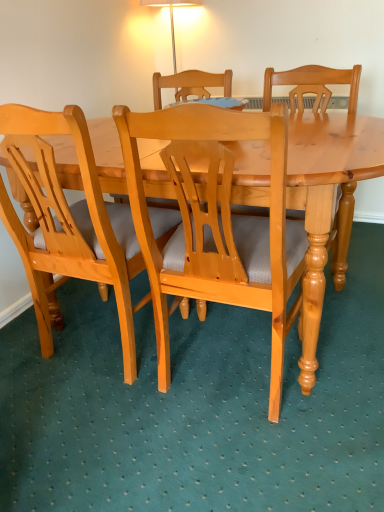
Find the location of `vacant area in front of light brown wood chair at center, positioned as the first chair in right-to-left order`. vacant area in front of light brown wood chair at center, positioned as the first chair in right-to-left order is located at coordinates coord(268,462).